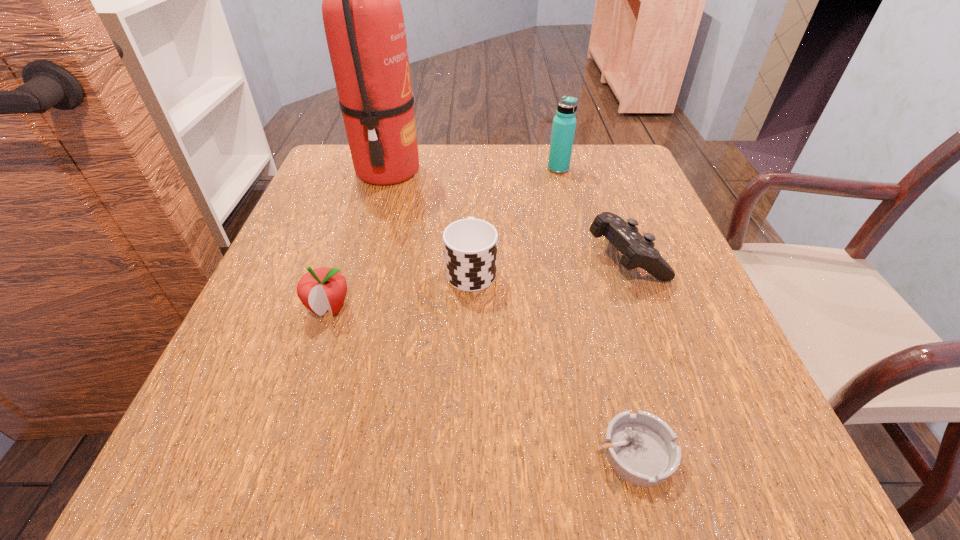
At what (x,y) coordinates should I click in order to perform the action: click on fire extinguisher. Please return your answer as a coordinate pair (x, y). Looking at the image, I should click on (363, 19).

You are a GUI agent. You are given a task and a screenshot of the screen. Output one action in this format:
    pyautogui.click(x=<x>, y=<y>)
    Task: Click on the second tallest object
    The image size is (960, 540).
    Given the screenshot: What is the action you would take?
    pyautogui.click(x=563, y=129)

In order to click on apple in this screenshot , I will do `click(321, 289)`.

I want to click on the third object from left to right, so click(470, 245).

The image size is (960, 540). I want to click on control, so click(638, 251).

The height and width of the screenshot is (540, 960). I want to click on the nearest object, so click(x=641, y=448).

Where is `ashtray`? This screenshot has height=540, width=960. ashtray is located at coordinates (641, 448).

At what (x,y) coordinates should I click in order to perform the action: click on blank area located 0.250m on the side of the tallest object with the nozzle and handle. Please return your answer as a coordinate pair (x, y). Image resolution: width=960 pixels, height=540 pixels. Looking at the image, I should click on (523, 171).

What are the coordinates of `free space located on the left of the fifth shortest object` in the screenshot? It's located at (519, 169).

Identify the location of vacant area located 0.140m on the back of the apple. (351, 241).